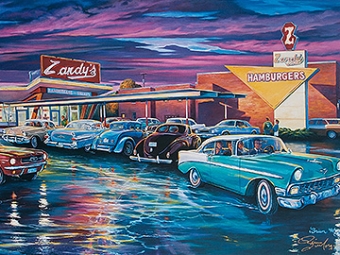
The height and width of the screenshot is (255, 340). Identify the location of painting. (114, 41).